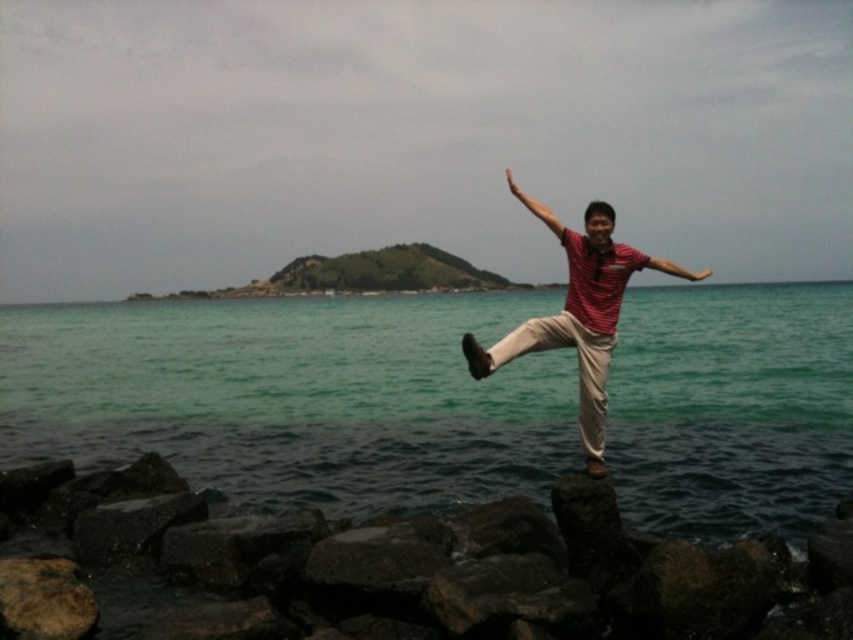
In the scene shown: Is green water at center positioned behind dark gray rock at lower center?

Yes.

Is point (276, 348) positioned behind point (163, 506)?

Yes, it is behind point (163, 506).

What are the coordinates of `green water at center` in the screenshot? It's located at pos(294,396).

Who is higher up, red striped shirt at center or red matte arm at upper center?

Positioned higher is red matte arm at upper center.

Who is positioned more to the right, red striped shirt at center or red matte arm at upper center?

Positioned to the right is red matte arm at upper center.

Which is behind, point (531, 317) or point (509, 192)?

The point (509, 192) is behind.

Where is `red striped shirt at center`? Image resolution: width=853 pixels, height=640 pixels. red striped shirt at center is located at coordinates (578, 314).

Does dark gray rock at lower center lie behind red matte arm at upper center?

No, dark gray rock at lower center is closer to the viewer.

Between dark gray rock at lower center and red matte arm at upper center, which one is positioned lower?

dark gray rock at lower center

I want to click on dark gray rock at lower center, so click(x=392, y=568).